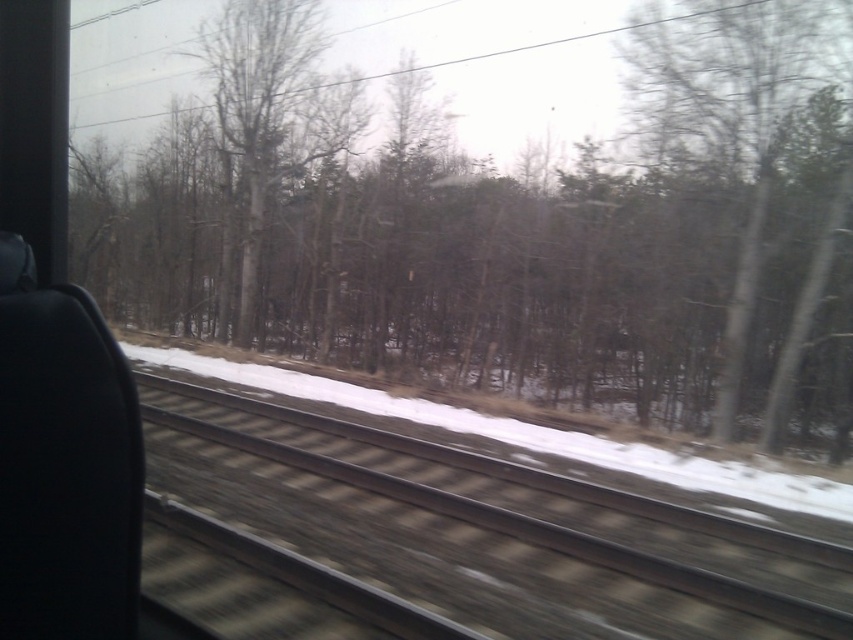
Question: Which point is closer to the camera?

Choices:
 (A) (590, 636)
 (B) (640, 378)

Answer: (A)

Question: Which point is farther to the camera?

Choices:
 (A) brown/dry wood at center
 (B) brown textured track at center

Answer: (A)

Question: Is brown/dry wood at center bigger than brown textured track at center?

Choices:
 (A) no
 (B) yes

Answer: (B)

Question: Does brown/dry wood at center appear under brown textured track at center?

Choices:
 (A) no
 (B) yes

Answer: (A)

Question: Is the position of brown/dry wood at center less distant than that of brown textured track at center?

Choices:
 (A) no
 (B) yes

Answer: (A)

Question: Which point is closer to the camera?

Choices:
 (A) (639, 627)
 (B) (590, 304)

Answer: (A)